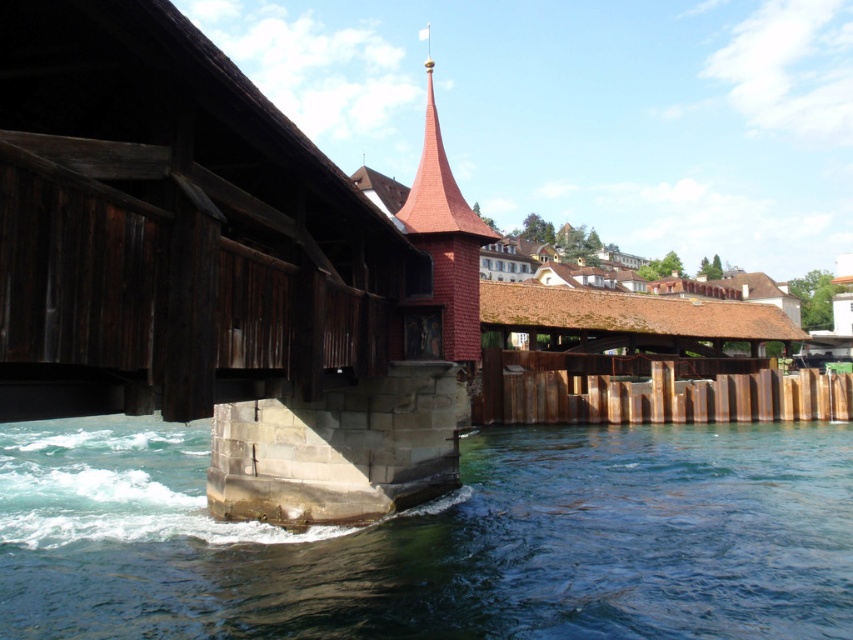
You are an architect analyzing the composition of this image. Based on the visual weight, which object takes up more space in the scene? Please choose between the clear blue water at lower left and the red wood spire at center.

The red wood spire at center occupies more space in the scene than the clear blue water at lower left according to the description.

You are standing on the wooden covered bridge and looking towards the red roofed building with the spire. There are two points marked on the bridge deck. One is at coordinate point (1,522) and the other is at point (442,266). If you want to place a bench closer to you on the bridge deck, which point should you choose?

You should choose point (1,522) because it is closer to you than point (442,266).